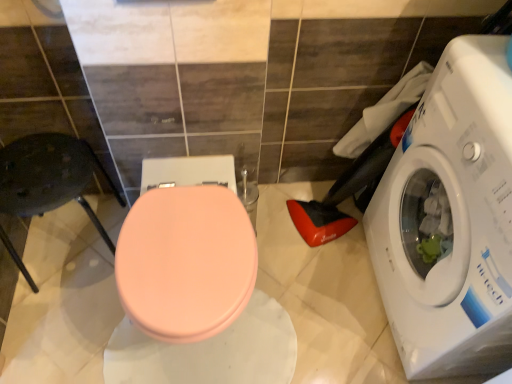
Question: Is metallic dark gray chair at left a part of matte pink lid at center?

Choices:
 (A) yes
 (B) no

Answer: (B)

Question: From the image's perspective, would you say matte pink lid at center is shown under metallic dark gray chair at left?

Choices:
 (A) no
 (B) yes

Answer: (B)

Question: From a real-world perspective, is matte pink lid at center below metallic dark gray chair at left?

Choices:
 (A) no
 (B) yes

Answer: (A)

Question: Would you consider matte pink lid at center to be distant from metallic dark gray chair at left?

Choices:
 (A) no
 (B) yes

Answer: (A)

Question: Considering the relative sizes of matte pink lid at center and metallic dark gray chair at left in the image provided, is matte pink lid at center smaller than metallic dark gray chair at left?

Choices:
 (A) yes
 (B) no

Answer: (B)

Question: In terms of size, does metallic dark gray chair at left appear bigger or smaller than white glossy washing machine at right?

Choices:
 (A) big
 (B) small

Answer: (B)

Question: Does point (39, 163) appear closer or farther from the camera than point (459, 115)?

Choices:
 (A) closer
 (B) farther

Answer: (B)

Question: Is metallic dark gray chair at left wider or thinner than white glossy washing machine at right?

Choices:
 (A) wide
 (B) thin

Answer: (B)

Question: From a real-world perspective, is metallic dark gray chair at left above or below white glossy washing machine at right?

Choices:
 (A) below
 (B) above

Answer: (A)

Question: In terms of width, does matte pink lid at center look wider or thinner when compared to white glossy washing machine at right?

Choices:
 (A) thin
 (B) wide

Answer: (B)

Question: From the image's perspective, is matte pink lid at center positioned above or below white glossy washing machine at right?

Choices:
 (A) above
 (B) below

Answer: (B)

Question: Is matte pink lid at center inside the boundaries of white glossy washing machine at right, or outside?

Choices:
 (A) inside
 (B) outside

Answer: (B)

Question: Looking at the image, does matte pink lid at center seem bigger or smaller compared to white glossy washing machine at right?

Choices:
 (A) small
 (B) big

Answer: (A)

Question: Is white glossy washing machine at right situated inside matte pink lid at center or outside?

Choices:
 (A) inside
 (B) outside

Answer: (B)

Question: Considering the positions of white glossy washing machine at right and matte pink lid at center in the image, is white glossy washing machine at right bigger or smaller than matte pink lid at center?

Choices:
 (A) small
 (B) big

Answer: (B)